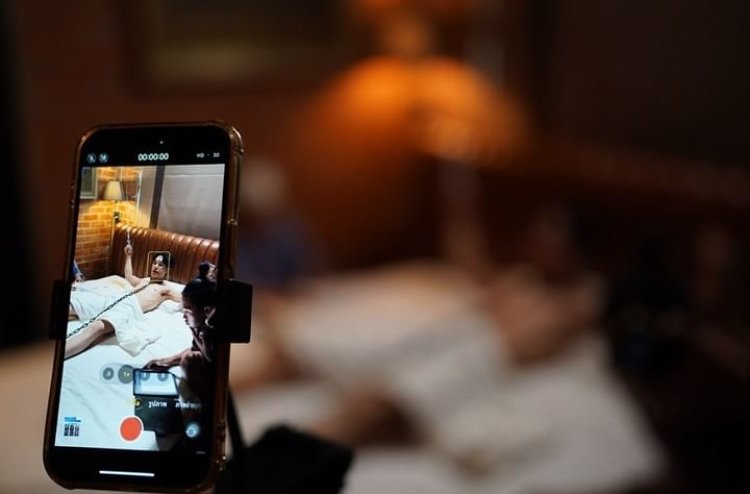
I want to click on laptop, so click(157, 389).